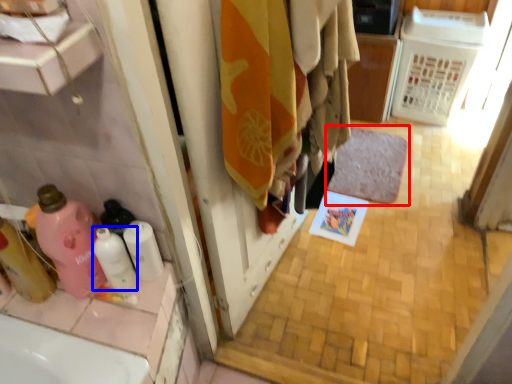
Question: Which object appears farthest to the camera in this image, bath mat (highlighted by a red box) or cleaning product (highlighted by a blue box)?

Choices:
 (A) bath mat
 (B) cleaning product

Answer: (A)